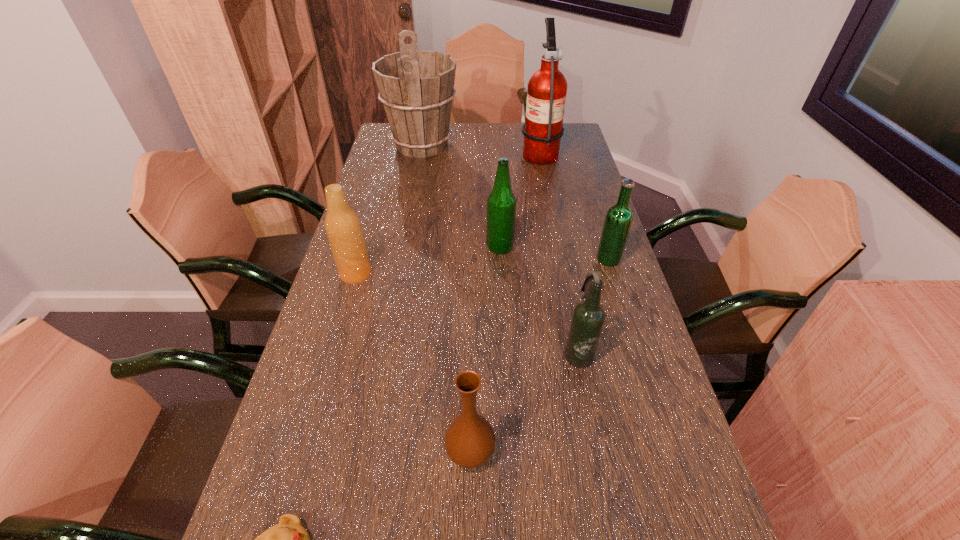
This screenshot has width=960, height=540. What are the coordinates of `vacant region between the second beer bottle from right to left and the leftmost beer bottle` in the screenshot? It's located at [467, 313].

Identify the location of unoccupied position between the second beer bottle from left to right and the rightmost beer bottle. This screenshot has width=960, height=540. (554, 253).

The image size is (960, 540). Identify the location of empty space between the fire extinguisher and the seventh farthest object. (505, 302).

This screenshot has width=960, height=540. What are the coordinates of `vacant space that's between the leftmost beer bottle and the vase` in the screenshot? It's located at (413, 363).

Identify the location of free space between the fire extinguisher and the rightmost object. The height and width of the screenshot is (540, 960). coord(574,206).

You are a GUI agent. You are given a task and a screenshot of the screen. Output one action in this format:
    pyautogui.click(x=<x>, y=<y>)
    Task: Click on the vacant space that is in between the second beer bottle from left to right and the rightmost beer bottle
    
    Given the screenshot: What is the action you would take?
    pyautogui.click(x=554, y=253)

Identify which object is the third nearest to the third beer bottle from right to left. Please provide its 2D coordinates. Your answer should be formatted as a tuple, i.e. [(x, y)], where the tuple contains the x and y coordinates of a point satisfying the conditions above.

[(343, 228)]

Select which object appears as the second closest to the tallest object. Please provide its 2D coordinates. Your answer should be formatted as a tuple, i.e. [(x, y)], where the tuple contains the x and y coordinates of a point satisfying the conditions above.

[(501, 204)]

The width and height of the screenshot is (960, 540). Find the location of `beer bottle that is the second closest to the leftmost beer bottle`. beer bottle that is the second closest to the leftmost beer bottle is located at coordinates (588, 318).

Locate an element on the screen. The height and width of the screenshot is (540, 960). the third closest beer bottle relative to the rightmost object is located at coordinates (343, 228).